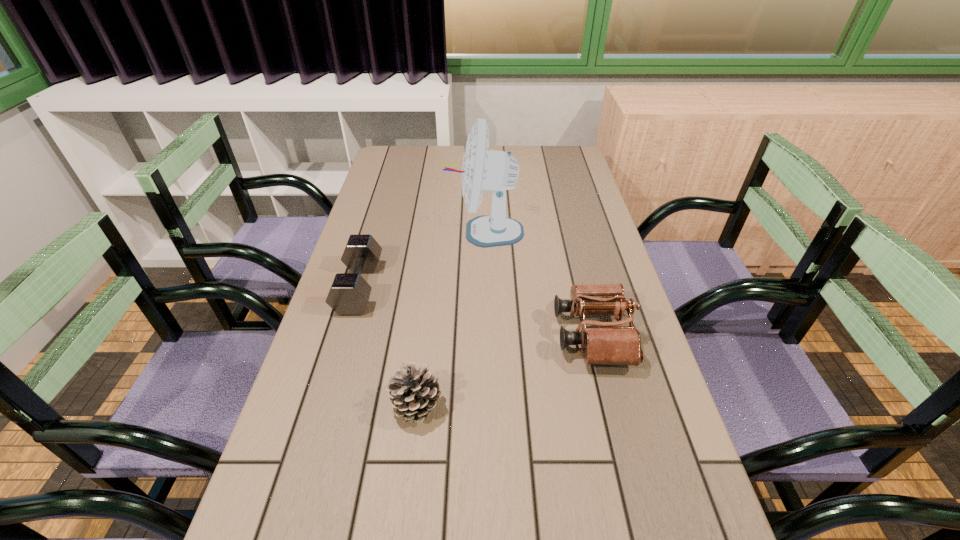
This screenshot has width=960, height=540. Identify the location of vacant area that lies between the nearest object and the tallest object. (450, 319).

Where is `empty location between the dumbbell and the tallest object`? The image size is (960, 540). empty location between the dumbbell and the tallest object is located at coordinates 421,259.

Identify the location of free spot between the binoculars and the farthest object. (539, 284).

This screenshot has width=960, height=540. In order to click on free space between the leftmost object and the binoculars in this screenshot , I will do `click(476, 311)`.

Image resolution: width=960 pixels, height=540 pixels. I want to click on free space between the pinecone and the leftmost object, so click(388, 346).

Locate an element on the screen. vacant space that's between the farthest object and the pinecone is located at coordinates (450, 319).

Identify which object is located as the nearest to the dumbbell. Please provide its 2D coordinates. Your answer should be formatted as a tuple, i.e. [(x, y)], where the tuple contains the x and y coordinates of a point satisfying the conditions above.

[(495, 171)]

Locate which object ranks third in proximity to the rightmost object. Please provide its 2D coordinates. Your answer should be formatted as a tuple, i.e. [(x, y)], where the tuple contains the x and y coordinates of a point satisfying the conditions above.

[(349, 294)]

Identify the location of vacant space that satisfies the following two spatial constraints: 1. through the eyepieces of the rightmost object; 2. on the front side of the pinecone. This screenshot has height=540, width=960. (611, 405).